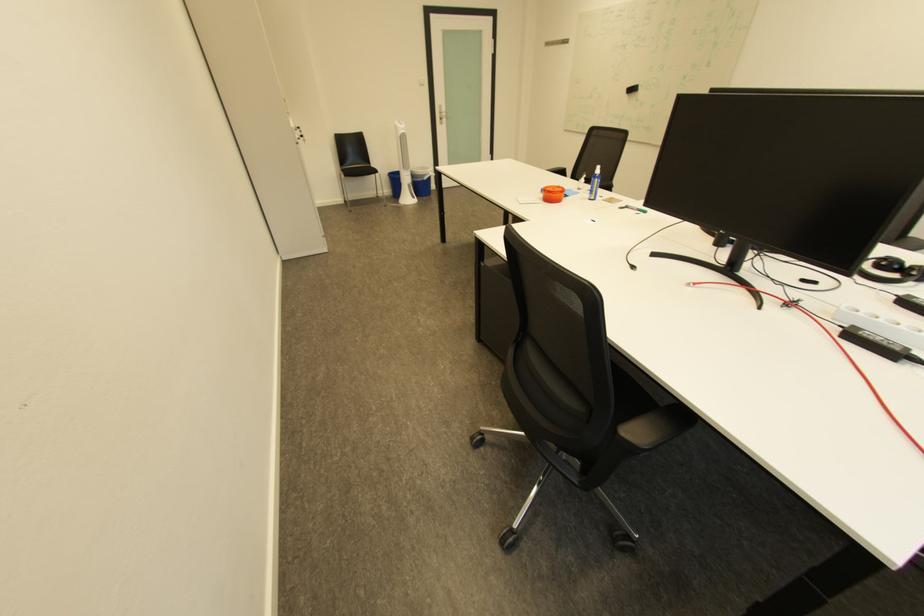
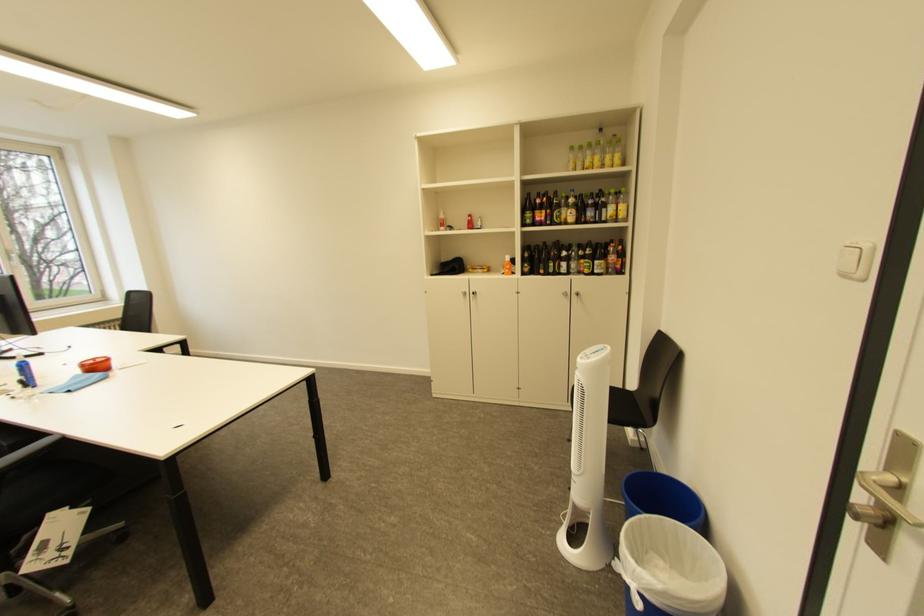
Where in the second image is the point corresponding to (x=439, y=175) from the first image?

(636, 570)